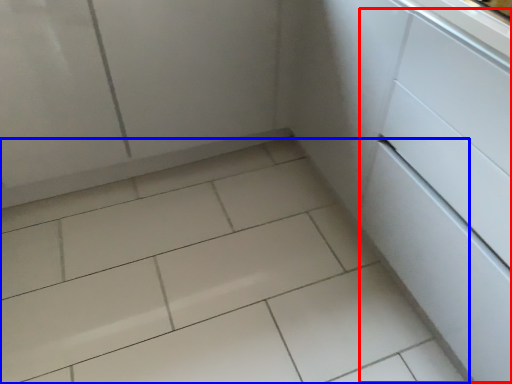
Question: Which of the following is the closest to the observer, drawer (highlighted by a red box) or ceramic tile (highlighted by a blue box)?

Choices:
 (A) drawer
 (B) ceramic tile

Answer: (A)